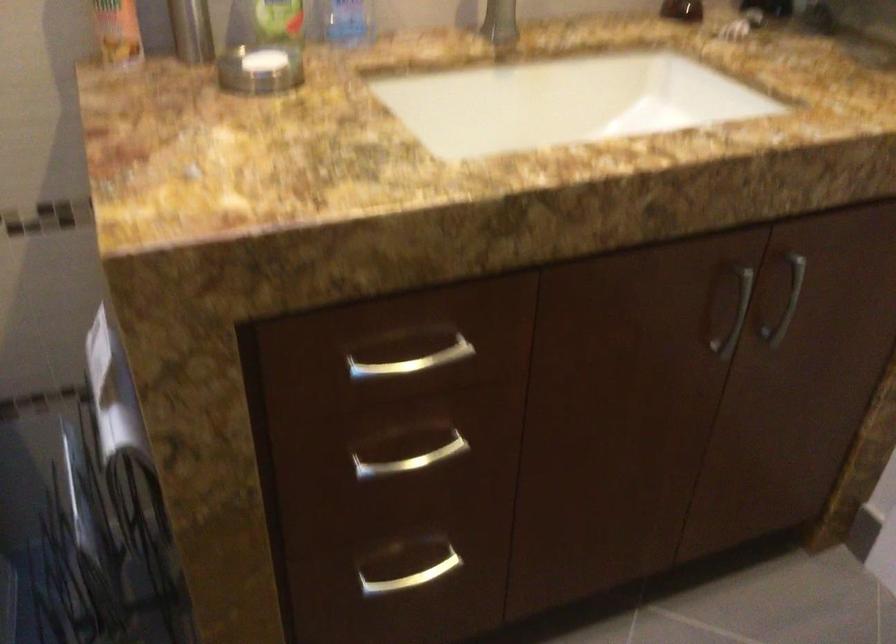
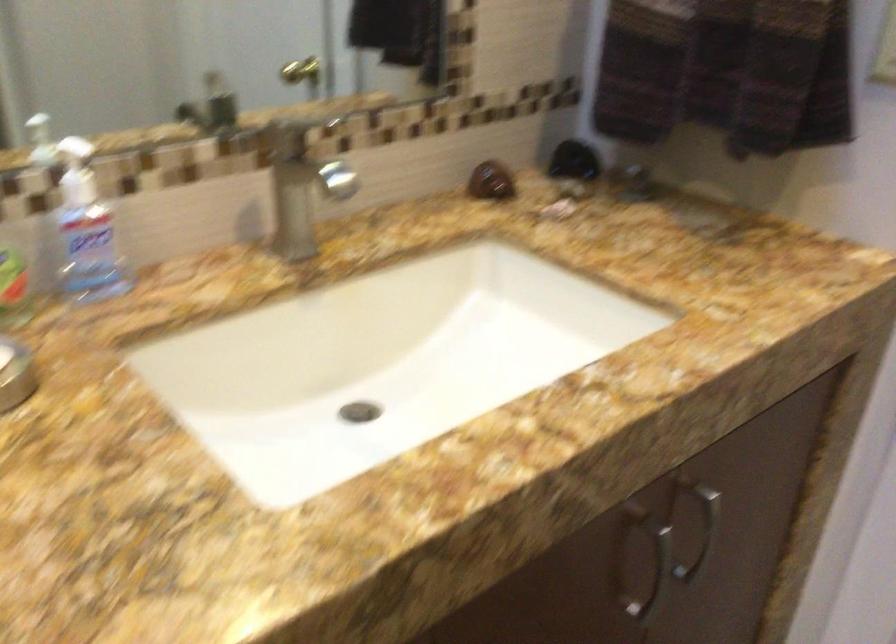
In the second image, find the point that corresponds to point 725,315 in the first image.

(642, 565)